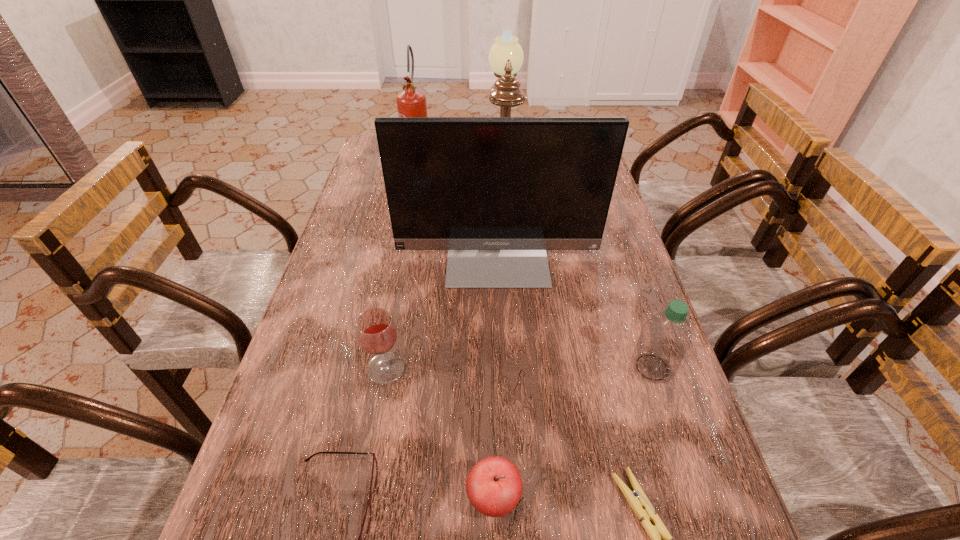
Find the location of a particular element. The image size is (960, 540). free space that satisfies the following two spatial constraints: 1. on the front side of the oil lamp; 2. on the right side of the fifth shortest object is located at coordinates (x=518, y=367).